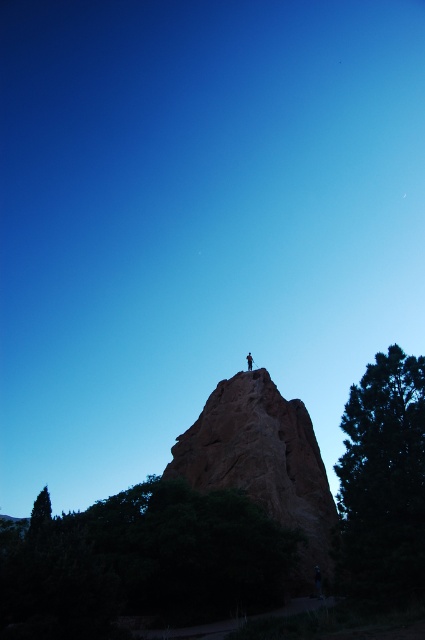
Is point (119, 529) farther from viewer compared to point (251, 369)?

That is False.

Who is more distant from viewer, (68,561) or (251,369)?

Positioned behind is point (251,369).

Identify the location of green leafy tree at lower left. This screenshot has width=425, height=640. (139, 561).

Does rustic stone peak at center have a greater width compared to dark brown leather jacket at upper center?

Indeed, rustic stone peak at center has a greater width compared to dark brown leather jacket at upper center.

Can you confirm if rustic stone peak at center is taller than dark brown leather jacket at upper center?

Correct, rustic stone peak at center is much taller as dark brown leather jacket at upper center.

Locate an element on the screen. This screenshot has width=425, height=640. rustic stone peak at center is located at coordinates (263, 461).

Between green leafy tree at lower left and rustic stone peak at center, which one has less height?

Standing shorter between the two is green leafy tree at lower left.

At what (x,y) coordinates should I click in order to perform the action: click on green leafy tree at lower left. Please return your answer as a coordinate pair (x, y). Image resolution: width=425 pixels, height=640 pixels. Looking at the image, I should click on (139, 561).

Locate an element on the screen. The height and width of the screenshot is (640, 425). green leafy tree at lower left is located at coordinates (139, 561).